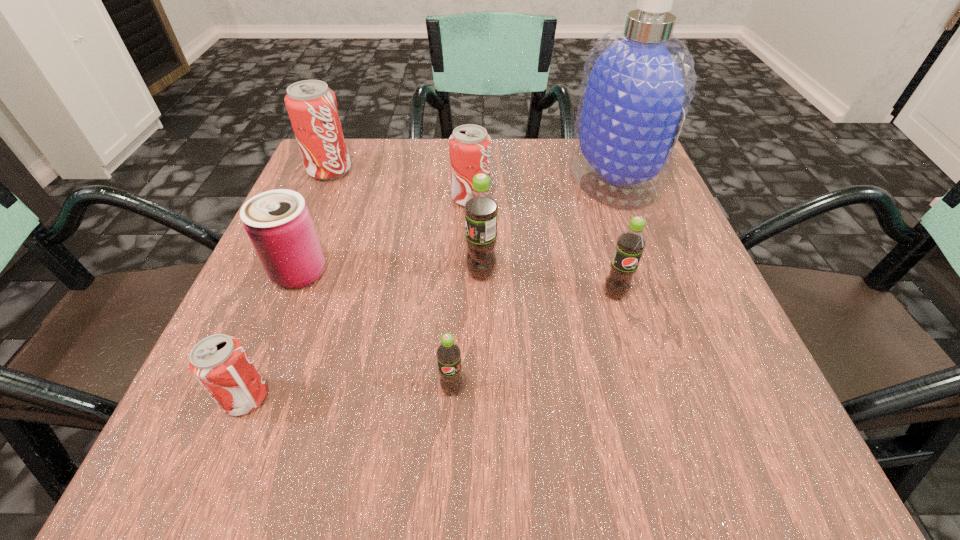
Image resolution: width=960 pixels, height=540 pixels. Identify the location of the tallest object. (638, 82).

This screenshot has height=540, width=960. I want to click on the farthest pink soda can, so click(x=312, y=107).

At what (x,y) coordinates should I click in order to perform the action: click on the farthest soda. Please return your answer as a coordinate pair (x, y). The image size is (960, 540). Looking at the image, I should click on (312, 107).

Where is `the biggest green soda`? This screenshot has width=960, height=540. the biggest green soda is located at coordinates (481, 208).

This screenshot has height=540, width=960. In order to click on the second smallest pink soda can in this screenshot , I will do `click(469, 146)`.

This screenshot has width=960, height=540. Identify the location of the second nearest pink soda can. (469, 146).

This screenshot has height=540, width=960. In order to click on the rightmost green soda in this screenshot , I will do `click(630, 244)`.

The height and width of the screenshot is (540, 960). Identify the location of the rightmost soda. (630, 244).

The height and width of the screenshot is (540, 960). What are the coordinates of `pink can` in the screenshot? It's located at (278, 222).

Image resolution: width=960 pixels, height=540 pixels. In order to click on the nearest pink soda can in this screenshot , I will do `click(219, 362)`.